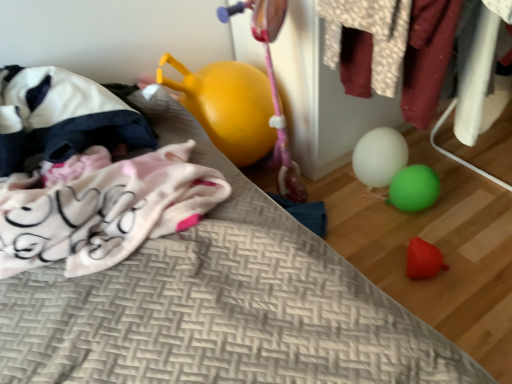
Question: Visually, is white fabric bean bag at left positioned to the left or to the right of white matte balloon at center?

Choices:
 (A) left
 (B) right

Answer: (A)

Question: In the image, is white fabric bean bag at left positioned in front of or behind white matte balloon at center?

Choices:
 (A) front
 (B) behind

Answer: (A)

Question: Estimate the real-world distances between objects in this image. Which object is closer to the white fabric bean bag at left?

Choices:
 (A) patterned fabric shirt at upper right
 (B) white matte balloon at center
 (C) velvet fabric clothes at right

Answer: (A)

Question: Estimate the real-world distances between objects in this image. Which object is closer to the patterned fabric shirt at upper right?

Choices:
 (A) white matte balloon at center
 (B) velvet fabric clothes at right
 (C) white fabric bean bag at left

Answer: (B)